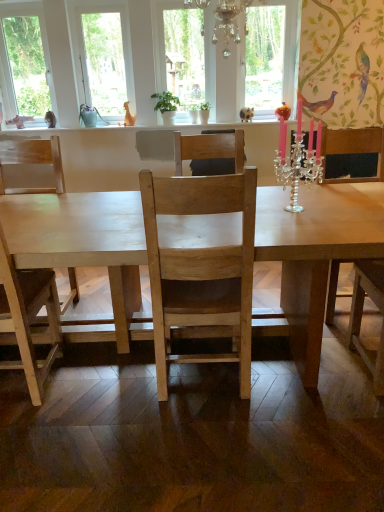
Question: Is wooden chair at right positioned in front of silver/crystal candle holder at upper right?

Choices:
 (A) no
 (B) yes

Answer: (A)

Question: Considering the relative sizes of wooden chair at right and silver/crystal candle holder at upper right in the image provided, is wooden chair at right taller than silver/crystal candle holder at upper right?

Choices:
 (A) no
 (B) yes

Answer: (B)

Question: Can you confirm if wooden chair at right is thinner than silver/crystal candle holder at upper right?

Choices:
 (A) yes
 (B) no

Answer: (B)

Question: From the image's perspective, is wooden chair at right under silver/crystal candle holder at upper right?

Choices:
 (A) no
 (B) yes

Answer: (B)

Question: From a real-world perspective, is wooden chair at right located beneath silver/crystal candle holder at upper right?

Choices:
 (A) no
 (B) yes

Answer: (B)

Question: Could you tell me if wooden chair at right is turned towards silver/crystal candle holder at upper right?

Choices:
 (A) no
 (B) yes

Answer: (A)

Question: From the image's perspective, is green matte plant at center above silver/crystal candle holder at upper right?

Choices:
 (A) no
 (B) yes

Answer: (B)

Question: Is green matte plant at center thinner than silver/crystal candle holder at upper right?

Choices:
 (A) yes
 (B) no

Answer: (A)

Question: Is green matte plant at center oriented towards silver/crystal candle holder at upper right?

Choices:
 (A) yes
 (B) no

Answer: (A)

Question: Is green matte plant at center taller than silver/crystal candle holder at upper right?

Choices:
 (A) yes
 (B) no

Answer: (B)

Question: Is green matte plant at center shorter than silver/crystal candle holder at upper right?

Choices:
 (A) yes
 (B) no

Answer: (A)

Question: Does green matte plant at center touch silver/crystal candle holder at upper right?

Choices:
 (A) no
 (B) yes

Answer: (A)

Question: Is silver/crystal candle holder at upper right further to the viewer compared to natural wood chair at center, which is the second chair in left-to-right order?

Choices:
 (A) yes
 (B) no

Answer: (B)